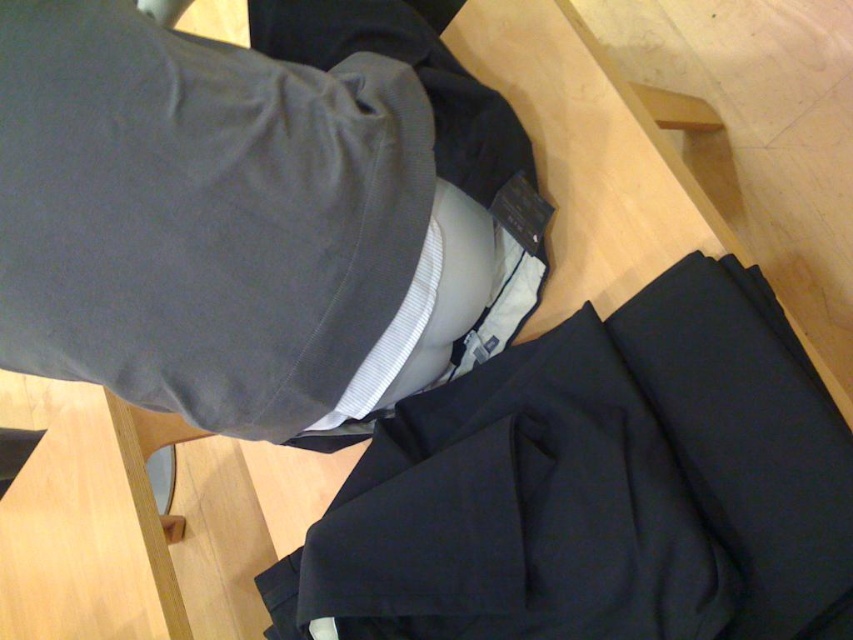
Question: Which object is closer to the camera taking this photo?

Choices:
 (A) dark gray fabric jacket at upper center
 (B) navy blue fabric pants at center

Answer: (A)

Question: Where is navy blue fabric pants at center located in relation to dark gray fabric jacket at upper center in the image?

Choices:
 (A) above
 (B) below

Answer: (B)

Question: Which of the following is the farthest from the observer?

Choices:
 (A) dark gray fabric jacket at upper center
 (B) navy blue fabric pants at center

Answer: (B)

Question: Which point appears closest to the camera in this image?

Choices:
 (A) (767, 570)
 (B) (96, 180)

Answer: (B)

Question: Is navy blue fabric pants at center wider than dark gray fabric jacket at upper center?

Choices:
 (A) no
 (B) yes

Answer: (B)

Question: Is navy blue fabric pants at center to the left of dark gray fabric jacket at upper center from the viewer's perspective?

Choices:
 (A) no
 (B) yes

Answer: (A)